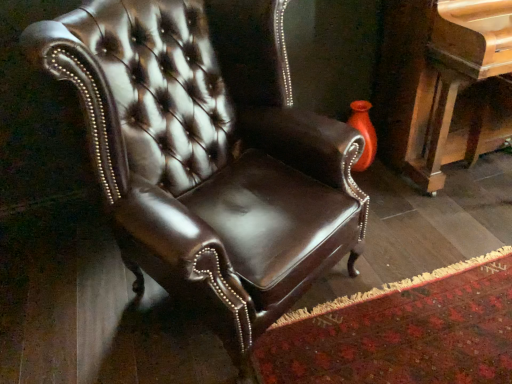
Image resolution: width=512 pixels, height=384 pixels. Find the location of `vacant space positioned to the left of shiny brown leather chair at center`. vacant space positioned to the left of shiny brown leather chair at center is located at coordinates (69, 299).